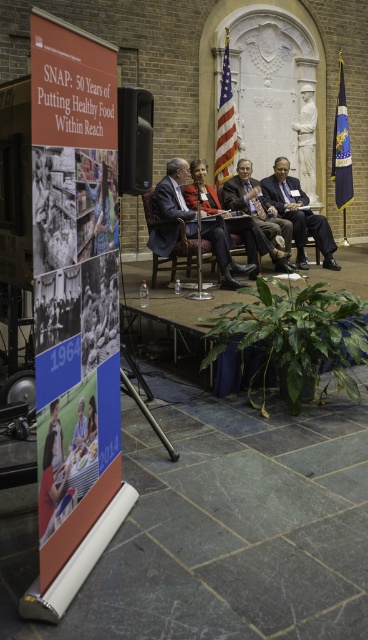
You are an attendee at this event and want to sit in the dark wood chair at center. However, there is an orange matte poster at left blocking your path. Can you move the poster to access the chair?

The orange matte poster at left is in front of the dark wood chair at center, so you can move the poster to access the chair.

You are a photographer at the event and need to position yourself so that both the wooden chair at center and the dark wood chair at center are in frame. Which chair should you place closer to the camera to ensure both are fully visible?

To ensure both the wooden chair at center and the dark wood chair at center are fully visible, you should place the dark wood chair at center closer to the camera since it is shorter than the wooden chair at center. This way, the taller wooden chair at center won not block the view of the shorter dark wood chair at center.